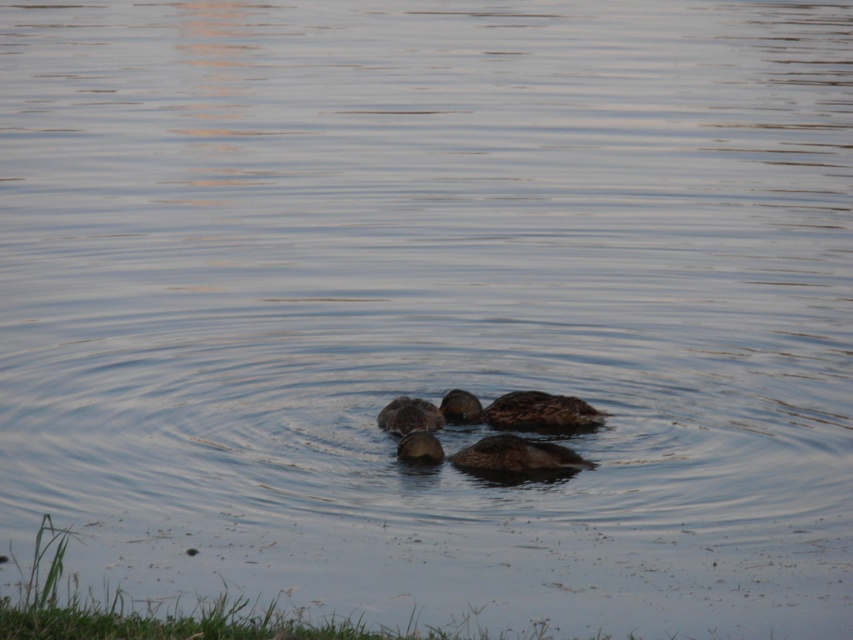
You are standing at the edge of the water and want to throw a small pebble to hit the brown fuzzy duck at center. If you aim directly at its current position, will the pebble hit the duck? Explain why based on the duck location.

The brown fuzzy duck at center is located at point (409, 416). Since ducks can move quickly, aiming directly at its current position might not hit it because the duck could have moved by the time the pebble reaches there.

You are observing the ducks in the water. Which duck is closer to you, the brown matte duck at center or the brown fuzzy duck at center?

The brown matte duck at center is closer to you because it is in front of the brown fuzzy duck at center.